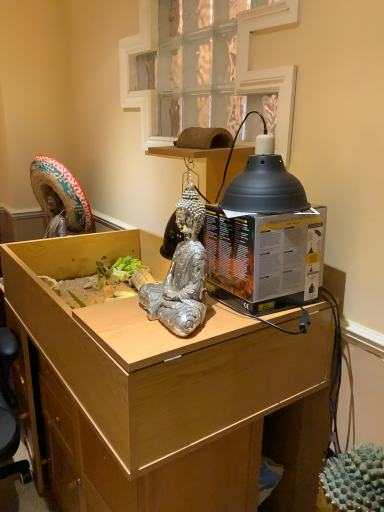
Describe the element at coordinates (270, 69) in the screenshot. I see `clear glass window at upper center` at that location.

Measure the distance between clear glass window at upper center and camera.

3.66 feet.

I want to click on black matte lampshade at upper right, so click(x=267, y=192).

Describe the element at coordinates (267, 192) in the screenshot. I see `black matte lampshade at upper right` at that location.

This screenshot has height=512, width=384. I want to click on silver metallic statue at center, so coord(182,273).

Find the location of a particular element. This screenshot has width=384, height=512. clear glass window at upper center is located at coordinates (270, 69).

Is black cardboard box at right turned away from silver metallic statue at center?

No, silver metallic statue at center is not at the back of black cardboard box at right.

From a real-world perspective, does black cardboard box at right sit lower than silver metallic statue at center?

Yes, from a real-world perspective, black cardboard box at right is below silver metallic statue at center.

Is black cardboard box at right wider than silver metallic statue at center?

Yes.

How many degrees apart are the facing directions of black cardboard box at right and silver metallic statue at center?

There is a 3.13-degree angle between the facing directions of black cardboard box at right and silver metallic statue at center.

How many degrees apart are the facing directions of light wood desk at center and black matte lampshade at upper right?

The angle between the facing direction of light wood desk at center and the facing direction of black matte lampshade at upper right is 3.63 degrees.

Does light wood desk at center turn towards black matte lampshade at upper right?

No, light wood desk at center is not aimed at black matte lampshade at upper right.

Considering the sizes of objects light wood desk at center and black matte lampshade at upper right in the image provided, who is taller, light wood desk at center or black matte lampshade at upper right?

light wood desk at center is taller.

From the image's perspective, which one is positioned lower, light wood desk at center or black matte lampshade at upper right?

From the image's view, light wood desk at center is below.

Based on their positions, is silver metallic statue at center located to the left or right of black matte lampshade at upper right?

In the image, silver metallic statue at center appears on the left side of black matte lampshade at upper right.

Is silver metallic statue at center with black matte lampshade at upper right?

They are not placed beside each other.

Does point (185, 273) lie behind point (292, 184)?

No.

From a real-world perspective, between silver metallic statue at center and black matte lampshade at upper right, who is vertically higher?

In real-world perspective, black matte lampshade at upper right is above.

Considering the positions of objects black cardboard box at right and clear glass window at upper center in the image provided, who is in front, black cardboard box at right or clear glass window at upper center?

black cardboard box at right is closer to the camera.

Which is more to the left, black cardboard box at right or clear glass window at upper center?

clear glass window at upper center is more to the left.

Is black cardboard box at right next to clear glass window at upper center?

No, black cardboard box at right is not making contact with clear glass window at upper center.

From the image's perspective, is black cardboard box at right located above clear glass window at upper center?

No, from the image's perspective, black cardboard box at right is not on top of clear glass window at upper center.

Would you consider black matte lampshade at upper right to be distant from silver metallic statue at center?

No, there isn't a large distance between black matte lampshade at upper right and silver metallic statue at center.

Is the depth of black matte lampshade at upper right greater than that of silver metallic statue at center?

Yes, it is behind silver metallic statue at center.

Can you confirm if black matte lampshade at upper right is shorter than silver metallic statue at center?

Indeed, black matte lampshade at upper right has a lesser height compared to silver metallic statue at center.

Can you confirm if black matte lampshade at upper right is thinner than light wood desk at center?

Indeed, black matte lampshade at upper right has a lesser width compared to light wood desk at center.

Is black matte lampshade at upper right positioned far away from light wood desk at center?

black matte lampshade at upper right is actually quite close to light wood desk at center.

Which point is more forward, (231,192) or (235,458)?

The point (231,192) is closer to the camera.

This screenshot has width=384, height=512. In order to click on desk directly beneath the black matte lampshade at upper right (from a real-world perspective) in this screenshot , I will do click(162, 392).

Which is farther, [244,75] or [280,277]?

The point [244,75] is behind.

From the picture: Which object is more forward, clear glass window at upper center or black cardboard box at right?

black cardboard box at right.

Which object is wider, clear glass window at upper center or black cardboard box at right?

With larger width is black cardboard box at right.

I want to click on box that is on the right side of silver metallic statue at center, so click(266, 256).

The width and height of the screenshot is (384, 512). Identify the location of desk located in front of the black matte lampshade at upper right. (162, 392).

Estimate the real-world distances between objects in this image. Which object is closer to silver metallic statue at center, clear glass window at upper center or light wood desk at center?

light wood desk at center lies closer to silver metallic statue at center than the other object.

When comparing their distances from black cardboard box at right, does silver metallic statue at center or clear glass window at upper center seem further?

Among the two, clear glass window at upper center is located further to black cardboard box at right.

When comparing their distances from silver metallic statue at center, does black matte lampshade at upper right or black cardboard box at right seem closer?

Among the two, black cardboard box at right is located nearer to silver metallic statue at center.

When comparing their distances from black matte lampshade at upper right, does clear glass window at upper center or silver metallic statue at center seem closer?

silver metallic statue at center.

Estimate the real-world distances between objects in this image. Which object is closer to black cardboard box at right, light wood desk at center or black matte lampshade at upper right?

black matte lampshade at upper right lies closer to black cardboard box at right than the other object.

In the scene shown: Estimate the real-world distances between objects in this image. Which object is closer to black cardboard box at right, black matte lampshade at upper right or silver metallic statue at center?

black matte lampshade at upper right lies closer to black cardboard box at right than the other object.

Estimate the real-world distances between objects in this image. Which object is further from light wood desk at center, black cardboard box at right or clear glass window at upper center?

clear glass window at upper center.

Based on the photo, when comparing their distances from black cardboard box at right, does clear glass window at upper center or black matte lampshade at upper right seem further?

The object further to black cardboard box at right is clear glass window at upper center.

I want to click on lamp between clear glass window at upper center and black cardboard box at right in the vertical direction, so click(x=267, y=192).

Locate an element on the screen. This screenshot has width=384, height=512. person between light wood desk at center and black cardboard box at right is located at coordinates (182, 273).

Where is `box between light wood desk at center and black matte lampshade at upper right`? The height and width of the screenshot is (512, 384). box between light wood desk at center and black matte lampshade at upper right is located at coordinates (266, 256).

The height and width of the screenshot is (512, 384). Identify the location of lamp that lies between clear glass window at upper center and light wood desk at center from top to bottom. (267, 192).